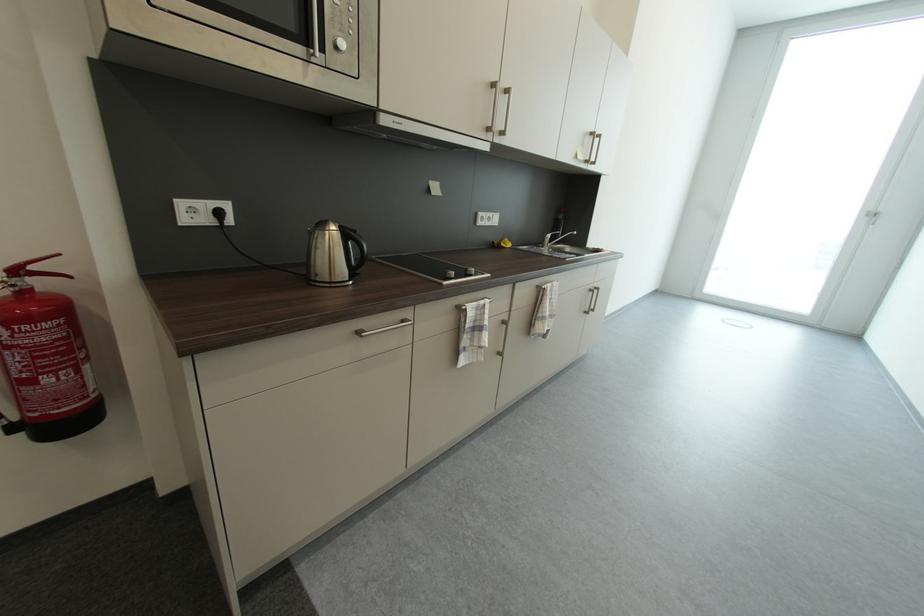
At what (x,y) coordinates should I click in order to perform the action: click on yellow sponge. Please return your answer as a coordinate pair (x, y). The width and height of the screenshot is (924, 616). Looking at the image, I should click on [x=505, y=243].